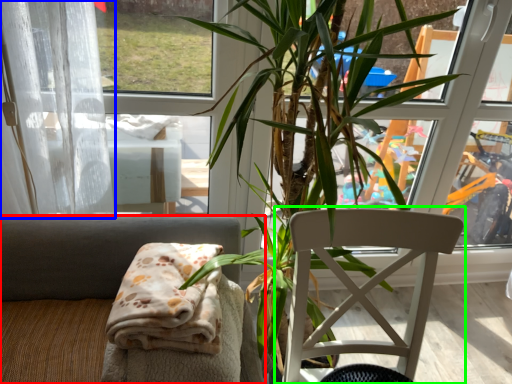
Question: Considering the real-world distances, which object is farthest from chair (highlighted by a red box)? curtain (highlighted by a blue box) or chair (highlighted by a green box)?

Choices:
 (A) curtain
 (B) chair

Answer: (B)